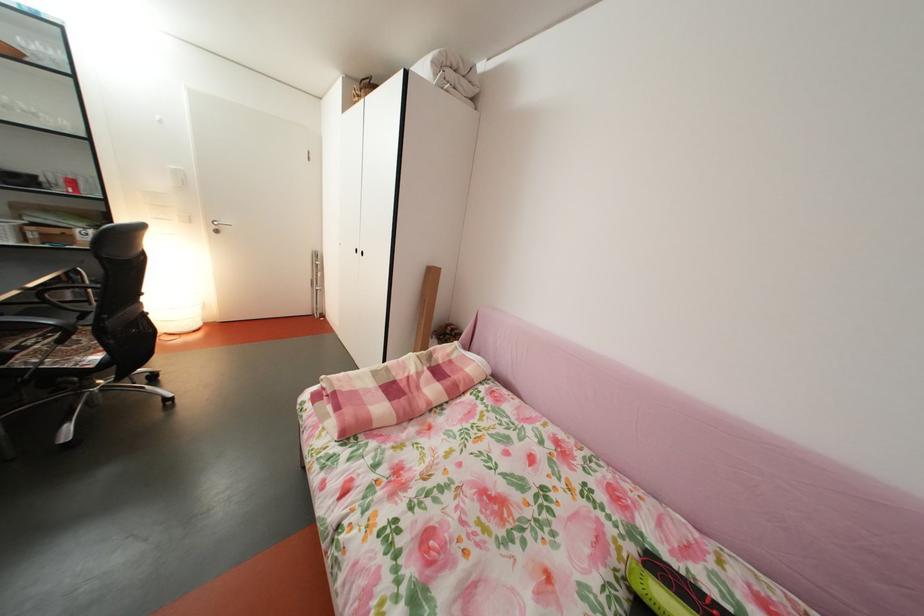
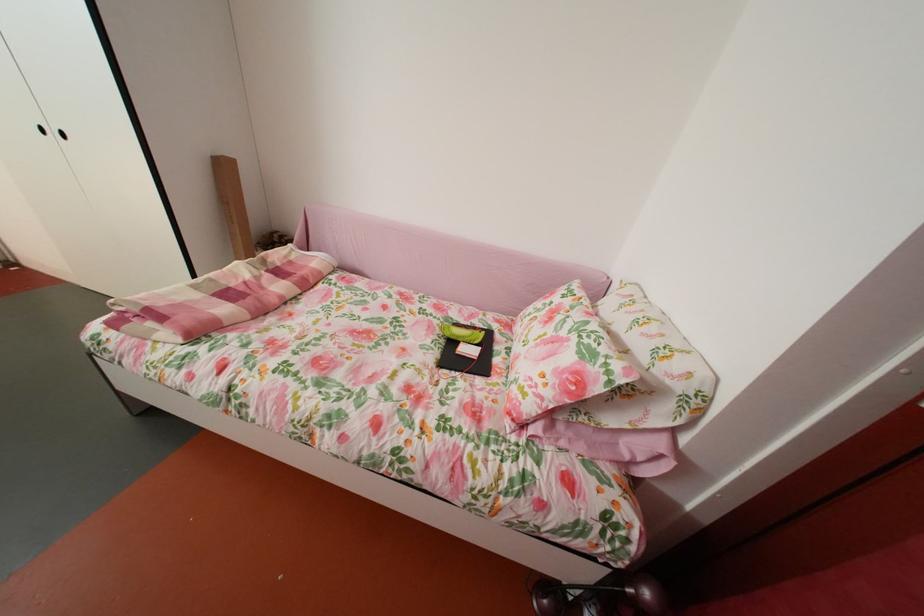
Question: I am providing you with two images of the same scene from different viewpoints. After the viewpoint changes to image2, which objects are now occluded?

Choices:
 (A) black cabinet handle
 (B) pink plaid blanket
 (C) floral print pillow
 (D) none of these

Answer: (D)